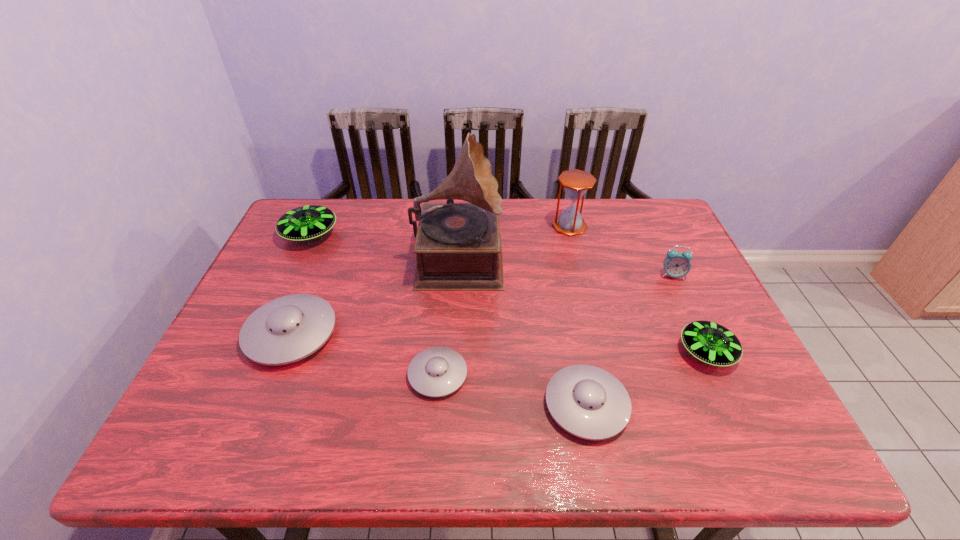
Find the location of a particular element. Image resolution: width=960 pixels, height=540 pixels. the rightmost gray saucer is located at coordinates (588, 402).

Find the location of a particular element. the smallest gray saucer is located at coordinates (438, 371).

Locate an element on the screen. The height and width of the screenshot is (540, 960). the third saucer from left to right is located at coordinates click(438, 371).

Where is `vacant area situated from the horn of the tallest object`? The image size is (960, 540). vacant area situated from the horn of the tallest object is located at coordinates (529, 254).

In order to click on blank area located 0.360m on the left of the seventh shortest object in this screenshot , I will do `click(442, 226)`.

Where is `vacant space located 0.390m on the face of the alarm clock`? Image resolution: width=960 pixels, height=540 pixels. vacant space located 0.390m on the face of the alarm clock is located at coordinates (733, 404).

Find the location of `free spot located 0.110m on the back of the bigger green saucer`. free spot located 0.110m on the back of the bigger green saucer is located at coordinates (326, 199).

Where is `vacant area situated 0.060m on the back of the leftmost gray saucer`? The height and width of the screenshot is (540, 960). vacant area situated 0.060m on the back of the leftmost gray saucer is located at coordinates (310, 286).

Identify the location of blank area located on the left of the smaller green saucer. This screenshot has height=540, width=960. (530, 352).

The width and height of the screenshot is (960, 540). What are the coordinates of `vacant region located 0.270m on the back of the fourth saucer from left to right` in the screenshot? It's located at (564, 289).